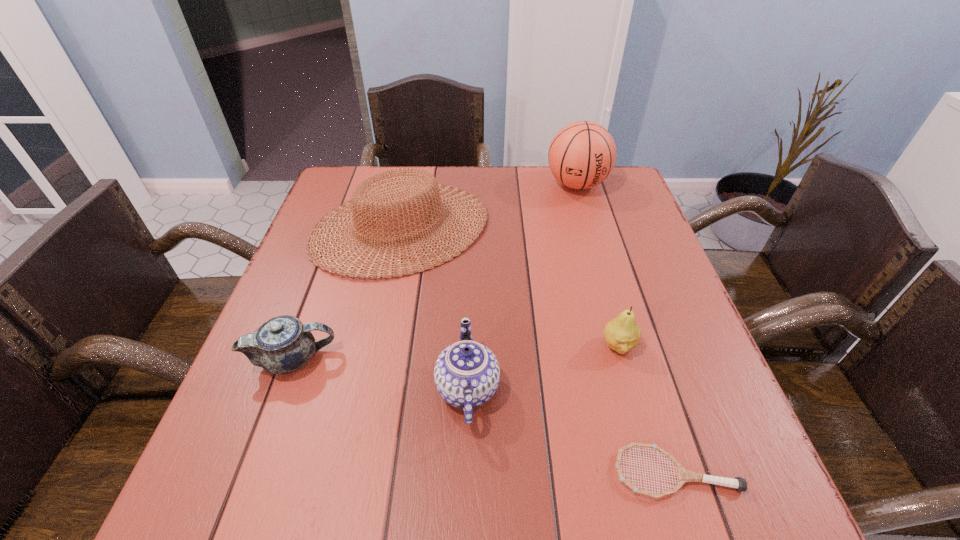
This screenshot has width=960, height=540. Find the location of `tennis racket that is at the right edge`. tennis racket that is at the right edge is located at coordinates (683, 475).

At what (x,y) coordinates should I click in order to perform the action: click on object that is at the far left corner. Please return your answer as a coordinate pair (x, y). Looking at the image, I should click on (367, 203).

At what (x,y) coordinates should I click in order to perform the action: click on object at the far right corner. Please return your answer as a coordinate pair (x, y). The height and width of the screenshot is (540, 960). Looking at the image, I should click on (582, 154).

Locate an element on the screen. object that is at the near right corner is located at coordinates (683, 475).

This screenshot has width=960, height=540. What are the coordinates of `vacant region at the far edge` in the screenshot? It's located at (574, 190).

In the image, there is a desktop. Where is `free space at the near edge`? free space at the near edge is located at coordinates (441, 487).

At what (x,y) coordinates should I click in order to perform the action: click on vacant space at the left edge. Please return your answer as a coordinate pair (x, y). Image resolution: width=960 pixels, height=540 pixels. Looking at the image, I should click on (344, 289).

I want to click on vacant space at the right edge, so click(647, 290).

Where is `blank space at the near left corner of the desktop`? blank space at the near left corner of the desktop is located at coordinates (206, 502).

This screenshot has width=960, height=540. What are the coordinates of `free region at the far right corner of the desktop` in the screenshot? It's located at (595, 192).